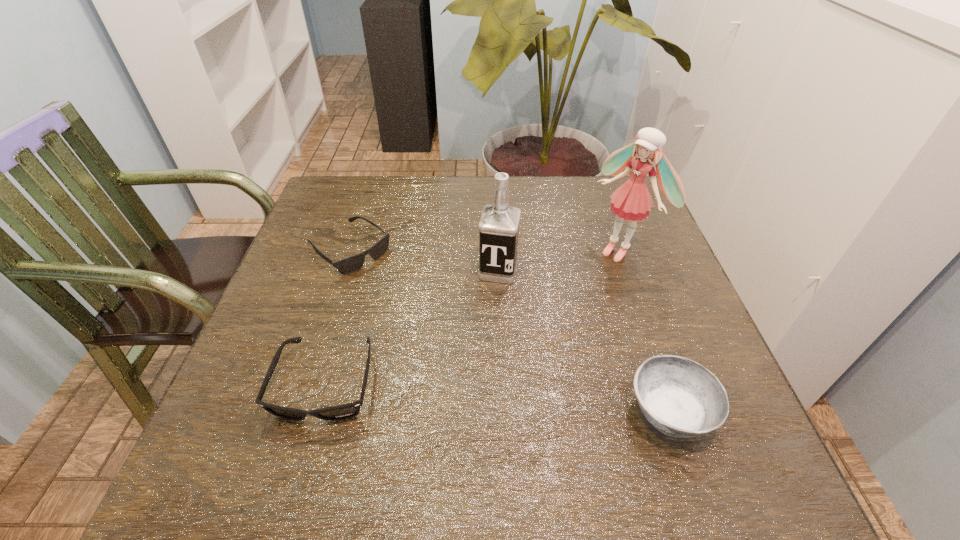
Where is `free space between the nearer sunglasses and the third object from right to left`? The height and width of the screenshot is (540, 960). free space between the nearer sunglasses and the third object from right to left is located at coordinates (413, 327).

Where is `empty space between the ashtray and the vodka`? The image size is (960, 540). empty space between the ashtray and the vodka is located at coordinates (584, 341).

Identify the location of vacant area that lies between the fourth tallest object and the third object from right to left. This screenshot has height=540, width=960. (413, 327).

Where is `free space that is in between the farther sunglasses and the taller sunglasses`? The height and width of the screenshot is (540, 960). free space that is in between the farther sunglasses and the taller sunglasses is located at coordinates (338, 316).

The width and height of the screenshot is (960, 540). In order to click on vacant region between the fourth shortest object and the tallest object in this screenshot , I will do `click(560, 260)`.

I want to click on free space that is in between the doll and the ashtray, so click(645, 331).

Find the location of a particular element. The width and height of the screenshot is (960, 540). free space between the doll and the ashtray is located at coordinates (645, 331).

Image resolution: width=960 pixels, height=540 pixels. In order to click on free spot between the fourth shortest object and the nearer sunglasses in this screenshot , I will do `click(413, 327)`.

The height and width of the screenshot is (540, 960). In order to click on free space between the fourth tallest object and the ashtray in this screenshot , I will do `click(498, 398)`.

This screenshot has height=540, width=960. I want to click on empty space between the ashtray and the taller sunglasses, so click(x=498, y=398).